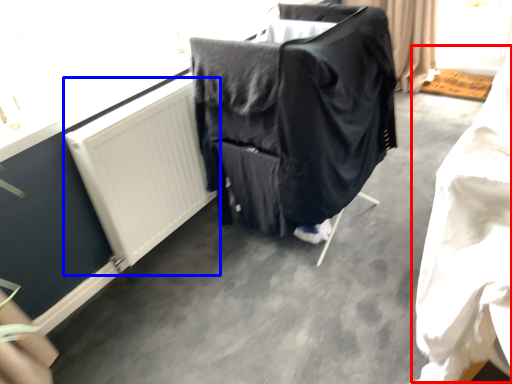
Question: Which of the following is the closest to the observer, clothing (highlighted by a red box) or radiator (highlighted by a blue box)?

Choices:
 (A) clothing
 (B) radiator

Answer: (A)